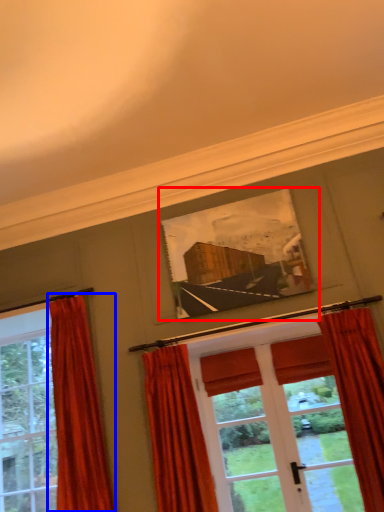
Question: Which point is further to the camera, picture frame (highlighted by a red box) or curtain (highlighted by a blue box)?

Choices:
 (A) picture frame
 (B) curtain

Answer: (A)